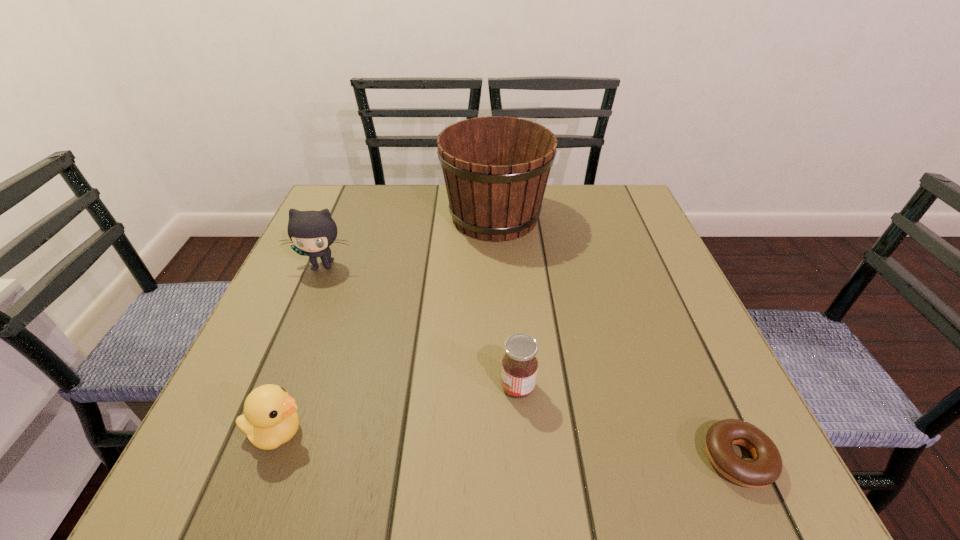
You are a GUI agent. You are given a task and a screenshot of the screen. Output one action in this format:
    pyautogui.click(x=<x>, y=<y>)
    Task: Click on the free space that satisfies the following two spatial constraints: 1. on the front side of the farthest object; 2. on the face of the duck
    
    Given the screenshot: What is the action you would take?
    pyautogui.click(x=505, y=433)

This screenshot has width=960, height=540. I want to click on free location that satisfies the following two spatial constraints: 1. on the face of the duck; 2. on the right side of the doughnut, so click(x=267, y=458).